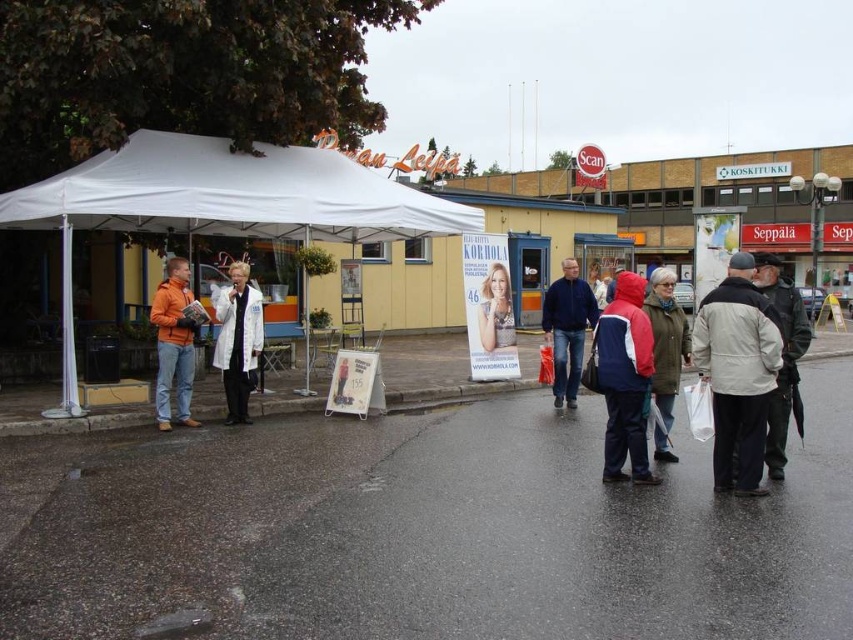
Question: Can you confirm if white lab coat at center is positioned to the right of blue denim jeans at center?

Choices:
 (A) no
 (B) yes

Answer: (A)

Question: Which point is farther to the camera?

Choices:
 (A) red and blue jacket at center
 (B) green wool coat at lower right

Answer: (B)

Question: Does orange matte jacket at left appear on the left side of smooth beige poster at center?

Choices:
 (A) no
 (B) yes

Answer: (B)

Question: Can you confirm if white fabric tent at center is positioned below dark gray jacket at right?

Choices:
 (A) yes
 (B) no

Answer: (A)

Question: Which point is farther to the camera?

Choices:
 (A) red and blue jacket at center
 (B) dark gray jacket at right
 (C) white lab coat at center
 (D) white fabric canopy at upper left

Answer: (D)

Question: Which of the following is the closest to the observer?

Choices:
 (A) light beige jacket at lower right
 (B) blue denim jeans at center
 (C) white lab coat at center
 (D) red and blue jacket at center

Answer: (A)